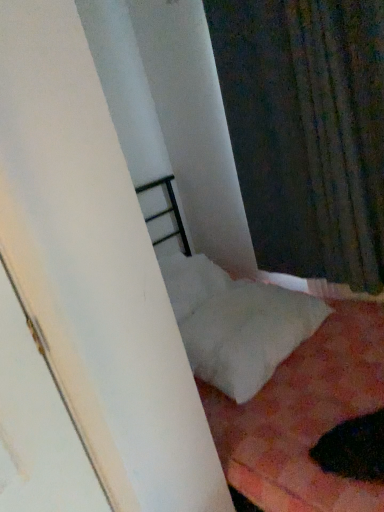
Question: Would you say white soft pillow at lower right is a long distance from dark textured fabric at upper right?

Choices:
 (A) no
 (B) yes

Answer: (A)

Question: Is white soft pillow at lower right facing towards dark textured fabric at upper right?

Choices:
 (A) no
 (B) yes

Answer: (A)

Question: Does white soft pillow at lower right have a greater height compared to dark textured fabric at upper right?

Choices:
 (A) yes
 (B) no

Answer: (B)

Question: Is white soft pillow at lower right smaller than dark textured fabric at upper right?

Choices:
 (A) yes
 (B) no

Answer: (A)

Question: Is white soft pillow at lower right thinner than dark textured fabric at upper right?

Choices:
 (A) yes
 (B) no

Answer: (B)

Question: From a real-world perspective, is white soft pillow at lower right under dark textured fabric at upper right?

Choices:
 (A) no
 (B) yes

Answer: (B)

Question: Can you see dark textured fabric at upper right touching white soft pillow at lower right?

Choices:
 (A) no
 (B) yes

Answer: (A)

Question: From the image's perspective, is dark textured fabric at upper right above white soft pillow at lower right?

Choices:
 (A) yes
 (B) no

Answer: (A)

Question: Is dark textured fabric at upper right far away from white soft pillow at lower right?

Choices:
 (A) no
 (B) yes

Answer: (A)

Question: Is dark textured fabric at upper right positioned in front of white soft pillow at lower right?

Choices:
 (A) yes
 (B) no

Answer: (A)

Question: From the image's perspective, does dark textured fabric at upper right appear lower than white soft pillow at lower right?

Choices:
 (A) yes
 (B) no

Answer: (B)

Question: Is white soft pillow at lower right surrounded by dark textured fabric at upper right?

Choices:
 (A) no
 (B) yes

Answer: (A)

Question: From a real-world perspective, does white soft pillow at lower right sit lower than white soft bed at lower right?

Choices:
 (A) no
 (B) yes

Answer: (A)